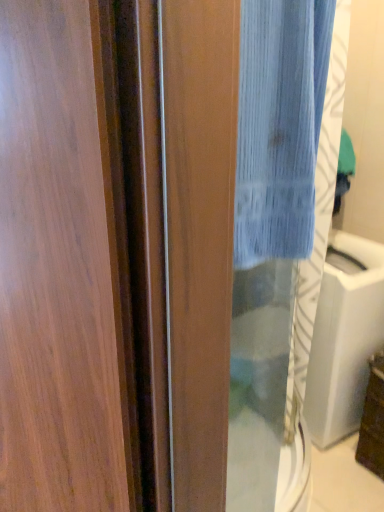
Question: Does wooden screen door at left have a greater height compared to blue textured fabric at center?

Choices:
 (A) yes
 (B) no

Answer: (A)

Question: Is wooden screen door at left not close to blue textured fabric at center?

Choices:
 (A) yes
 (B) no

Answer: (B)

Question: Considering the relative sizes of wooden screen door at left and blue textured fabric at center in the image provided, is wooden screen door at left thinner than blue textured fabric at center?

Choices:
 (A) no
 (B) yes

Answer: (A)

Question: Is wooden screen door at left to the left of blue textured fabric at center from the viewer's perspective?

Choices:
 (A) yes
 (B) no

Answer: (A)

Question: Is wooden screen door at left shorter than blue textured fabric at center?

Choices:
 (A) no
 (B) yes

Answer: (A)

Question: From the image's perspective, is wooden screen door at left over blue textured fabric at center?

Choices:
 (A) yes
 (B) no

Answer: (B)

Question: Can you confirm if wooden screen door at left is thinner than transparent glass sink at center?

Choices:
 (A) yes
 (B) no

Answer: (B)

Question: From the image's perspective, would you say wooden screen door at left is positioned over transparent glass sink at center?

Choices:
 (A) no
 (B) yes

Answer: (B)

Question: From the image's perspective, is wooden screen door at left located beneath transparent glass sink at center?

Choices:
 (A) no
 (B) yes

Answer: (A)

Question: Does wooden screen door at left appear on the left side of transparent glass sink at center?

Choices:
 (A) yes
 (B) no

Answer: (A)

Question: From a real-world perspective, is wooden screen door at left beneath transparent glass sink at center?

Choices:
 (A) yes
 (B) no

Answer: (B)

Question: Is wooden screen door at left shorter than transparent glass sink at center?

Choices:
 (A) no
 (B) yes

Answer: (A)

Question: From a real-world perspective, is blue textured fabric at center on transparent glass sink at center?

Choices:
 (A) yes
 (B) no

Answer: (A)